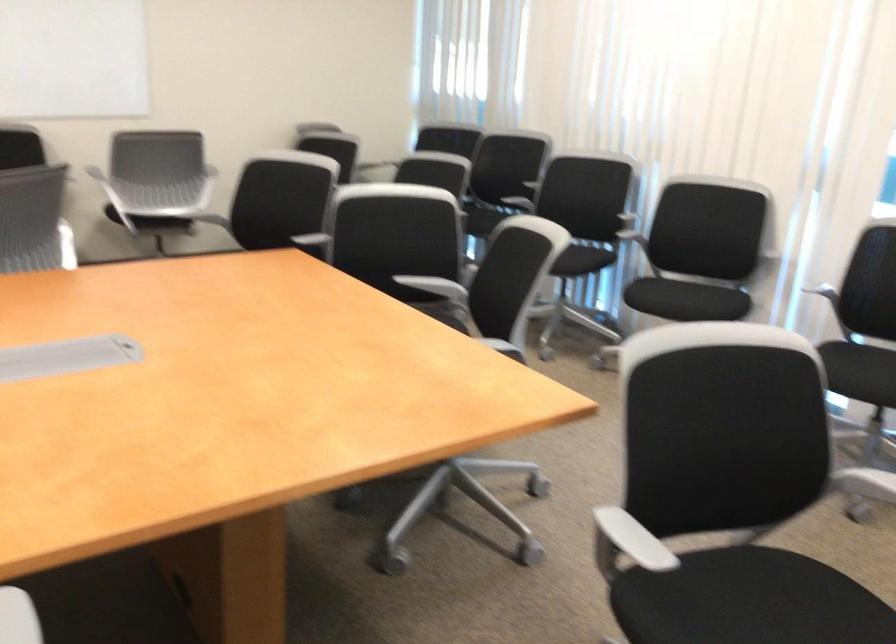
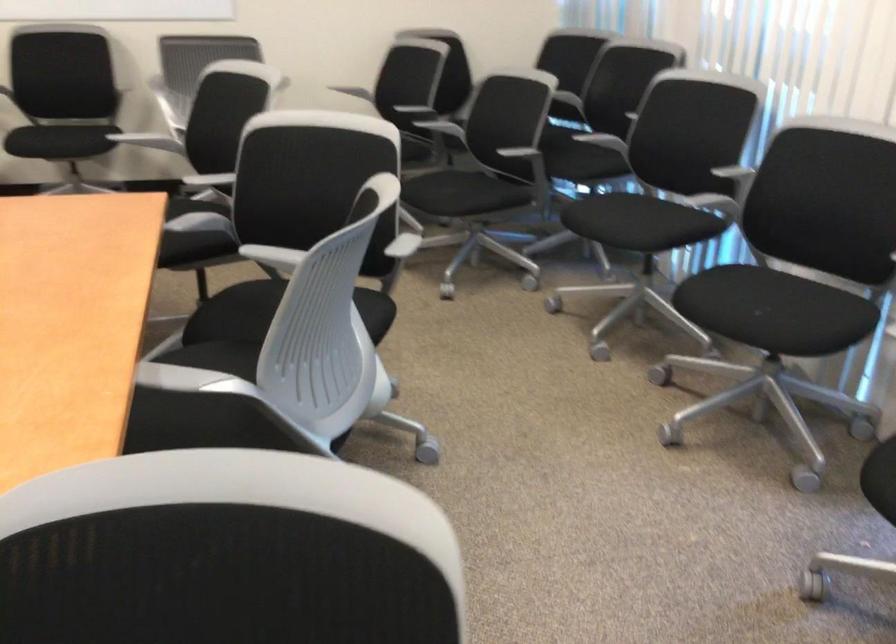
Locate, in the second image, the point that corresponds to point (485, 207) in the first image.

(588, 147)